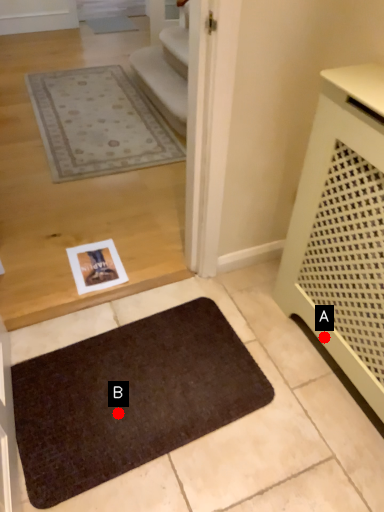
Question: Two points are circled on the image, labeled by A and B beside each circle. Which point appears closest to the camera in this image?

Choices:
 (A) A is closer
 (B) B is closer

Answer: (B)